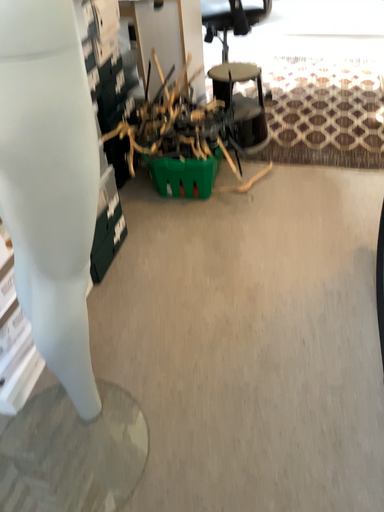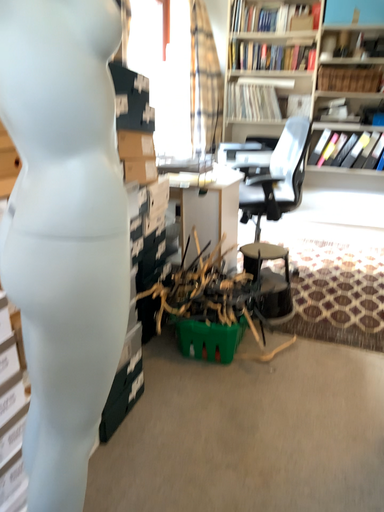
Question: Which way did the camera rotate in the video?

Choices:
 (A) rotated downward
 (B) rotated upward

Answer: (B)